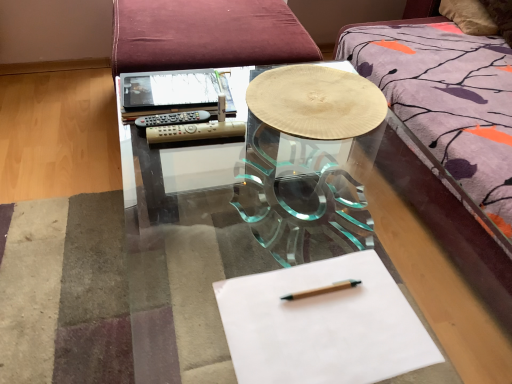
At what (x,y) coordinates should I click in order to perform the action: click on vacant area located to the right-hand side of wooden pencil at center. Please return your answer as a coordinate pair (x, y). Looking at the image, I should click on (379, 307).